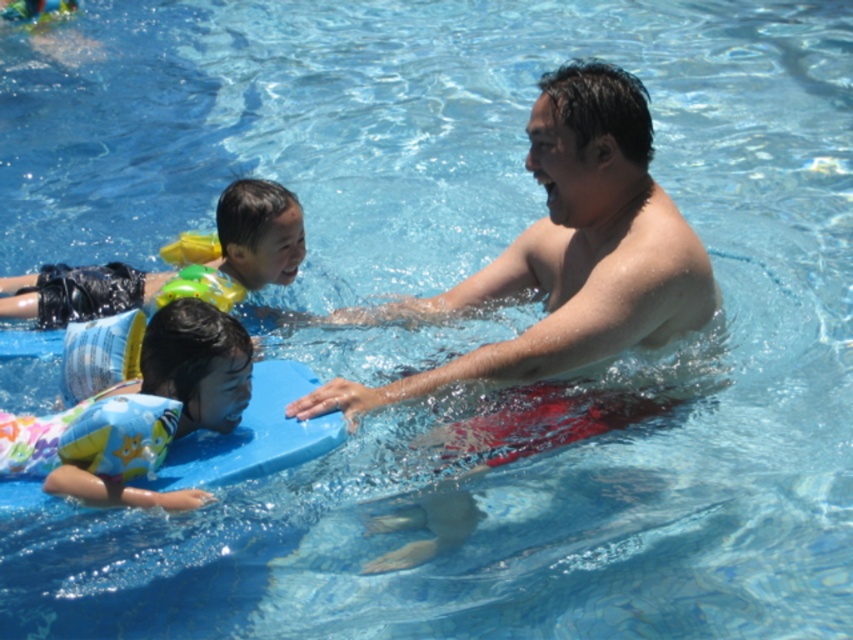
You are a lifeguard observing the swimming pool. You notice the shiny skin man at center and the yellow inflatable float at upper center. Which object is wider?

The shiny skin man at center is wider than the yellow inflatable float at upper center according to the description.